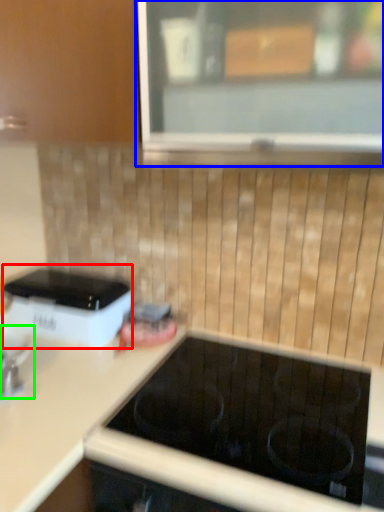
Question: Estimate the real-world distances between objects in this image. Which object is farther from home appliance (highlighted by a red box), window (highlighted by a blue box) or appliance (highlighted by a green box)?

Choices:
 (A) window
 (B) appliance

Answer: (A)